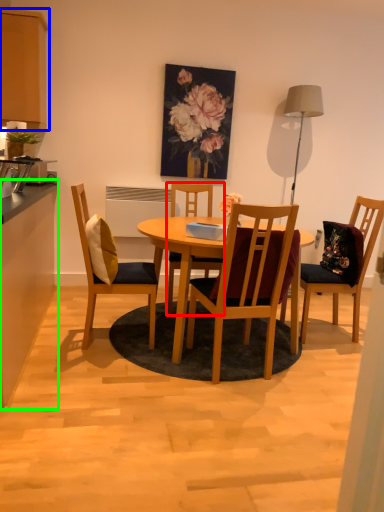
Question: Which object is positioned closest to chair (highlighted by a red box)? Select from cabinetry (highlighted by a blue box) and cabinetry (highlighted by a green box).

Choices:
 (A) cabinetry
 (B) cabinetry

Answer: (B)